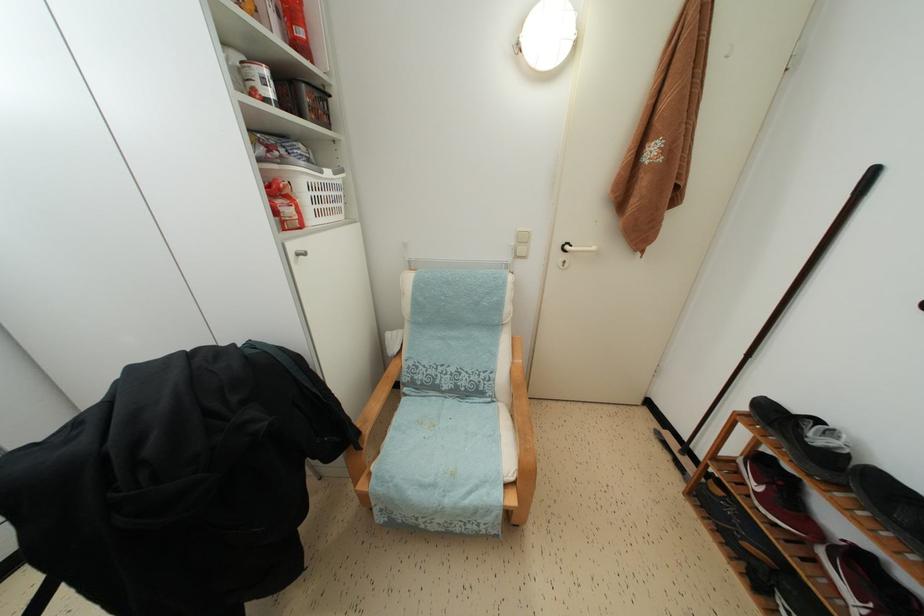
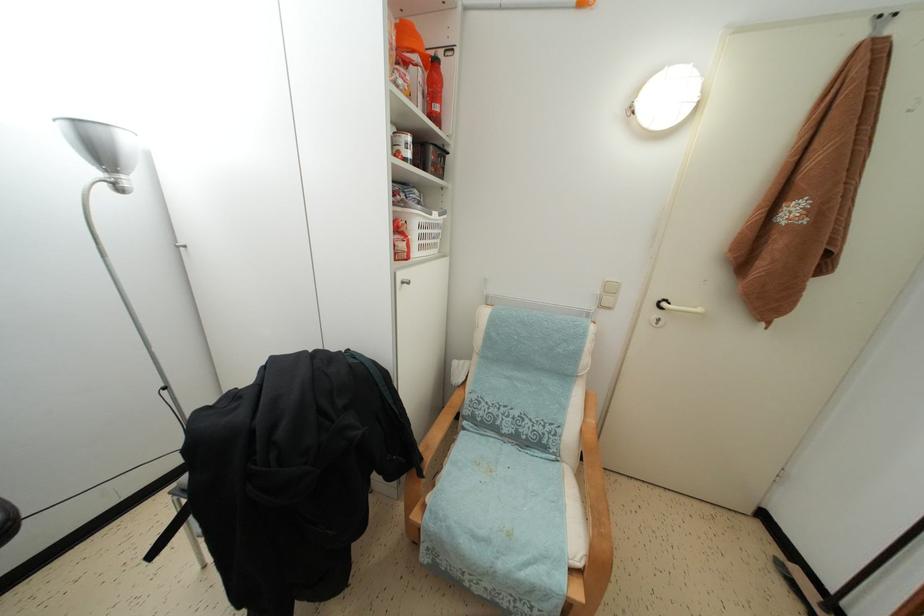
Question: The images are taken continuously from a first-person perspective. In which direction is your viewpoint rotating?

Choices:
 (A) Left
 (B) Right
 (C) Up
 (D) Down

Answer: (A)